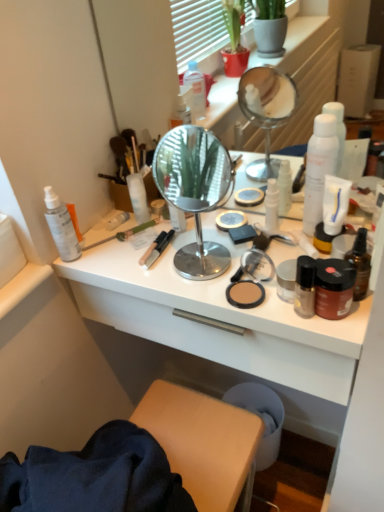
Where is `unoccupied region to the right of translucent plastic spray bottle at left, which is the eighth toiletry in right-to-left order`? This screenshot has width=384, height=512. unoccupied region to the right of translucent plastic spray bottle at left, which is the eighth toiletry in right-to-left order is located at coordinates (144, 252).